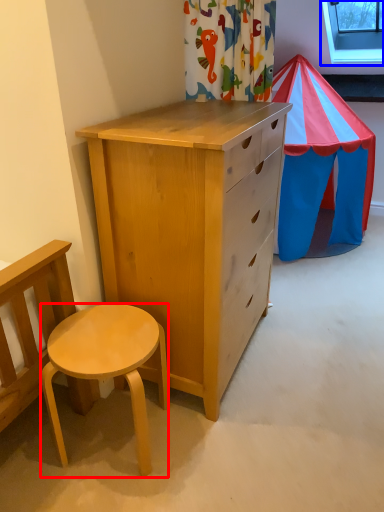
Question: Among these objects, which one is farthest to the camera, desk (highlighted by a red box) or window screen (highlighted by a blue box)?

Choices:
 (A) desk
 (B) window screen

Answer: (B)